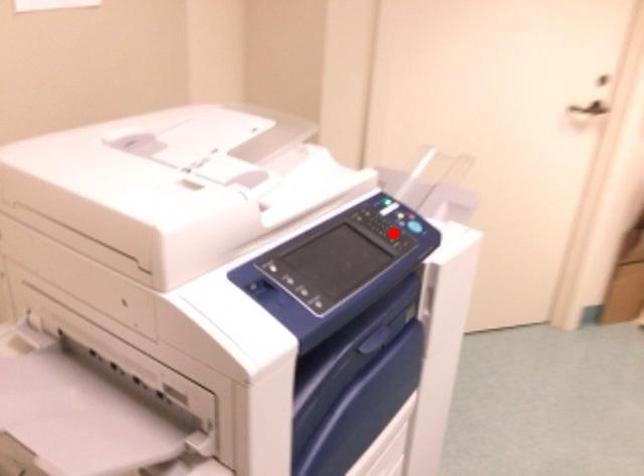
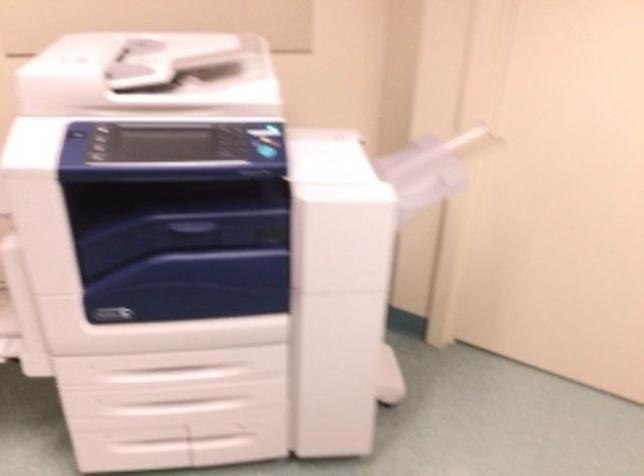
In the second image, find the point that corresponds to the highlighted location in the first image.

(232, 150)